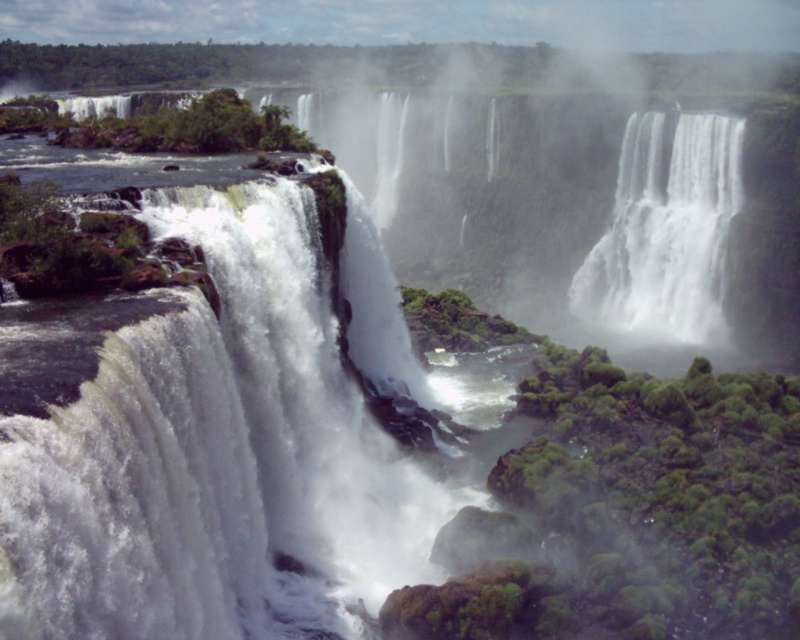
Question: Can you confirm if white frothy water at left is positioned to the left of white frothy water at center?

Choices:
 (A) yes
 (B) no

Answer: (A)

Question: Is white frothy water at left bigger than white frothy water at center?

Choices:
 (A) yes
 (B) no

Answer: (A)

Question: Which point is closer to the camera?

Choices:
 (A) (658, 259)
 (B) (380, 451)

Answer: (B)

Question: Which of the following is the closest to the observer?

Choices:
 (A) (108, 532)
 (B) (572, 305)

Answer: (A)

Question: Is white frothy water at left positioned behind white frothy water at center?

Choices:
 (A) yes
 (B) no

Answer: (B)